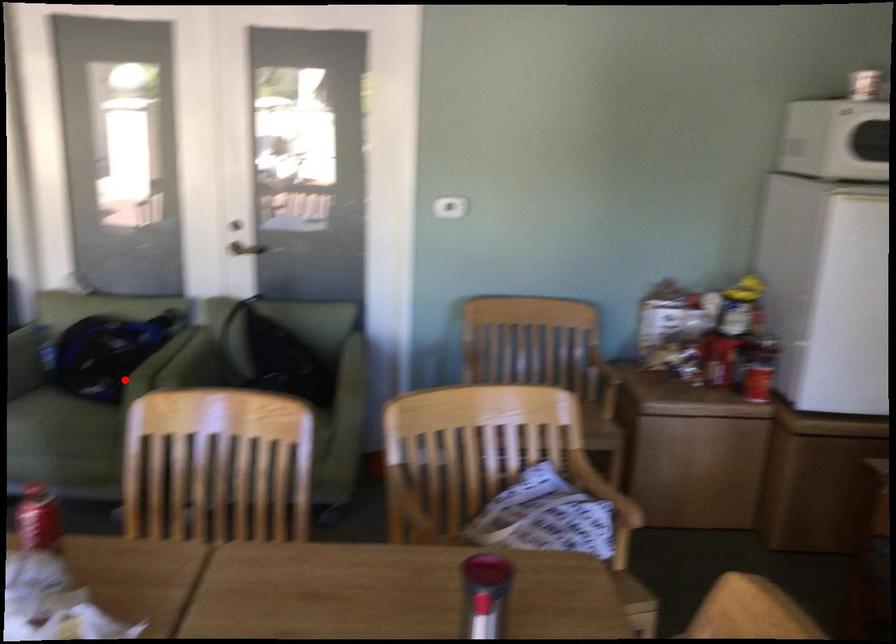
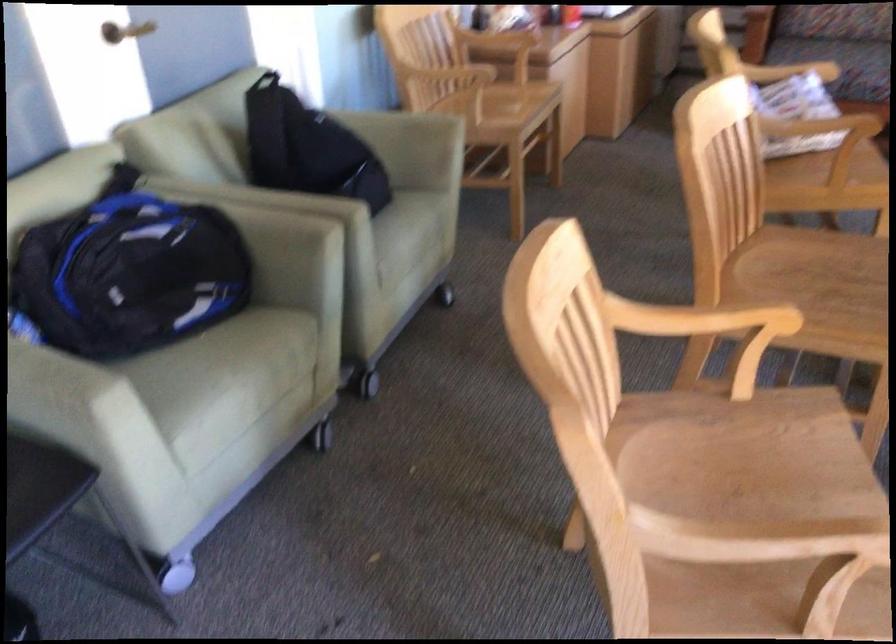
Where in the second image is the point corresponding to the highlighted location from the first image?

(289, 232)